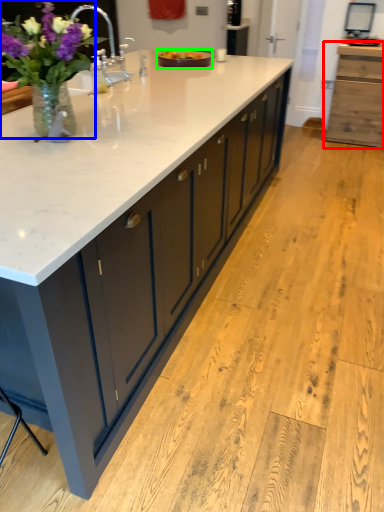
Question: Considering the real-world distances, which object is closest to cabinetry (highlighted by a red box)? houseplant (highlighted by a blue box) or tray (highlighted by a green box).

Choices:
 (A) houseplant
 (B) tray

Answer: (B)